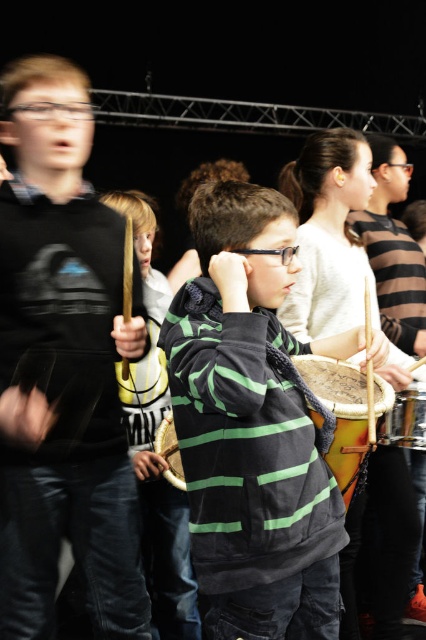
Question: Is brown leather drum at center wider than wooden drum at center?

Choices:
 (A) yes
 (B) no

Answer: (A)

Question: Which object appears closest to the camera in this image?

Choices:
 (A) brown leather drum at center
 (B) matte black hoodie at left

Answer: (A)

Question: Which object is positioned farthest from the brown leather drum at center?

Choices:
 (A) shiny metallic drum at lower right
 (B) matte black hoodie at left
 (C) wooden drum at center
 (D) green striped hoodie at center

Answer: (C)

Question: Which point is farther from the camera taking this photo?

Choices:
 (A) [126, 336]
 (B) [412, 385]
 (C) [175, 460]

Answer: (C)

Question: Does green striped hoodie at center come behind wooden drum at center?

Choices:
 (A) yes
 (B) no

Answer: (B)

Question: Is green striped hoodie at center positioned at the back of brown leather drum at center?

Choices:
 (A) yes
 (B) no

Answer: (B)